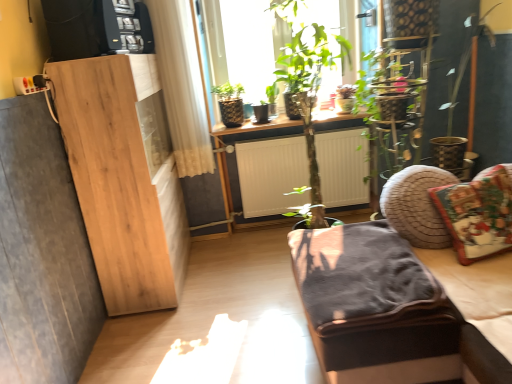
Question: Is christmas-patterned fabric pillow at right wider than velvet dark gray studio couch at lower right?

Choices:
 (A) no
 (B) yes

Answer: (A)

Question: Is christmas-patterned fabric pillow at right shorter than velvet dark gray studio couch at lower right?

Choices:
 (A) yes
 (B) no

Answer: (A)

Question: Considering the relative sizes of christmas-patterned fabric pillow at right and velvet dark gray studio couch at lower right in the image provided, is christmas-patterned fabric pillow at right smaller than velvet dark gray studio couch at lower right?

Choices:
 (A) yes
 (B) no

Answer: (A)

Question: Can you confirm if christmas-patterned fabric pillow at right is taller than velvet dark gray studio couch at lower right?

Choices:
 (A) yes
 (B) no

Answer: (B)

Question: From the image's perspective, is christmas-patterned fabric pillow at right under velvet dark gray studio couch at lower right?

Choices:
 (A) no
 (B) yes

Answer: (A)

Question: Is christmas-patterned fabric pillow at right with velvet dark gray studio couch at lower right?

Choices:
 (A) yes
 (B) no

Answer: (B)

Question: Is velvet dark gray studio couch at lower right at the left side of christmas-patterned fabric pillow at right?

Choices:
 (A) no
 (B) yes

Answer: (B)

Question: Is velvet dark gray studio couch at lower right positioned behind christmas-patterned fabric pillow at right?

Choices:
 (A) yes
 (B) no

Answer: (B)

Question: From the image's perspective, is velvet dark gray studio couch at lower right under christmas-patterned fabric pillow at right?

Choices:
 (A) yes
 (B) no

Answer: (A)

Question: Is velvet dark gray studio couch at lower right in front of christmas-patterned fabric pillow at right?

Choices:
 (A) yes
 (B) no

Answer: (A)

Question: From a real-world perspective, is velvet dark gray studio couch at lower right on top of christmas-patterned fabric pillow at right?

Choices:
 (A) no
 (B) yes

Answer: (A)

Question: Is christmas-patterned fabric pillow at right at the back of velvet dark gray studio couch at lower right?

Choices:
 (A) yes
 (B) no

Answer: (A)

Question: In the image, is christmas-patterned fabric pillow at right on the left side or the right side of velvet dark gray studio couch at lower right?

Choices:
 (A) right
 (B) left

Answer: (A)